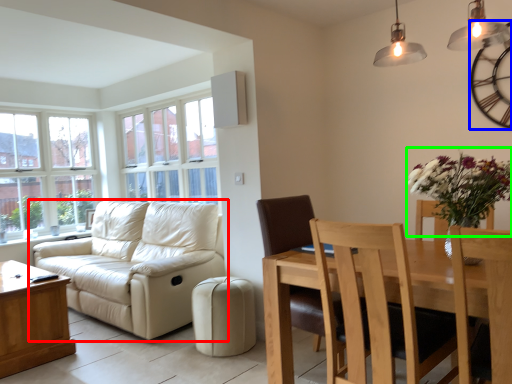
Question: Estimate the real-world distances between objects in this image. Which object is farther from studio couch (highlighted by a red box), clock (highlighted by a blue box) or floral arrangement (highlighted by a green box)?

Choices:
 (A) clock
 (B) floral arrangement

Answer: (A)